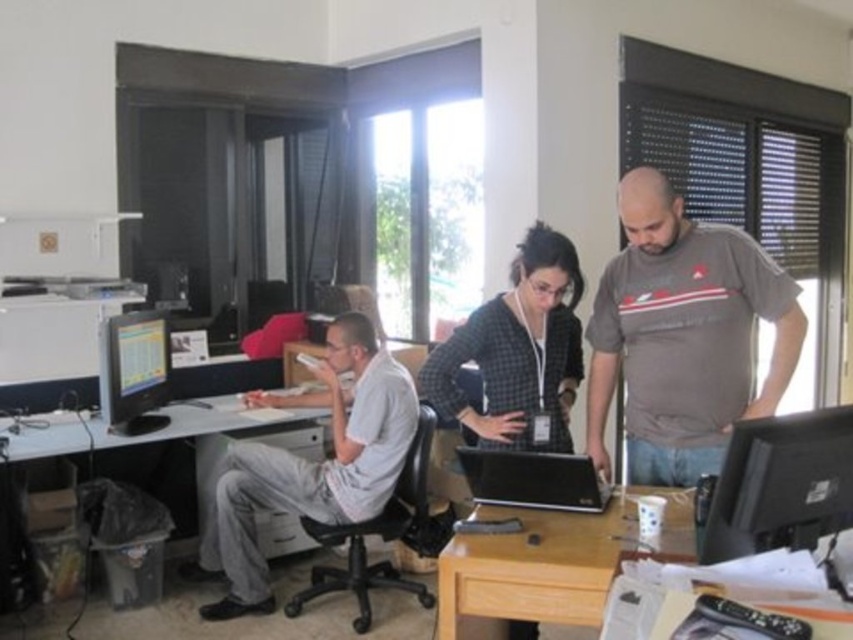
Question: Which point is closer to the camera?

Choices:
 (A) matte black monitor at left
 (B) white glossy computer desk at lower left
 (C) light brown wood computer desk at lower center
 (D) gray cotton t-shirt at center

Answer: (C)

Question: Is white glossy computer desk at lower left thinner than black glossy laptop at center?

Choices:
 (A) yes
 (B) no

Answer: (B)

Question: Does gray cotton t-shirt at center have a lesser width compared to matte black monitor at left?

Choices:
 (A) yes
 (B) no

Answer: (B)

Question: Which of the following is the closest to the observer?

Choices:
 (A) matte black monitor at left
 (B) black glossy laptop at center
 (C) gray cotton shirt at left
 (D) light brown wood computer desk at lower center

Answer: (D)

Question: Is light brown wood computer desk at lower center below white glossy computer desk at lower left?

Choices:
 (A) no
 (B) yes

Answer: (B)

Question: Estimate the real-world distances between objects in this image. Which object is closer to the white glossy computer desk at lower left?

Choices:
 (A) checkered fabric shirt at center
 (B) gray cotton t-shirt at center

Answer: (A)